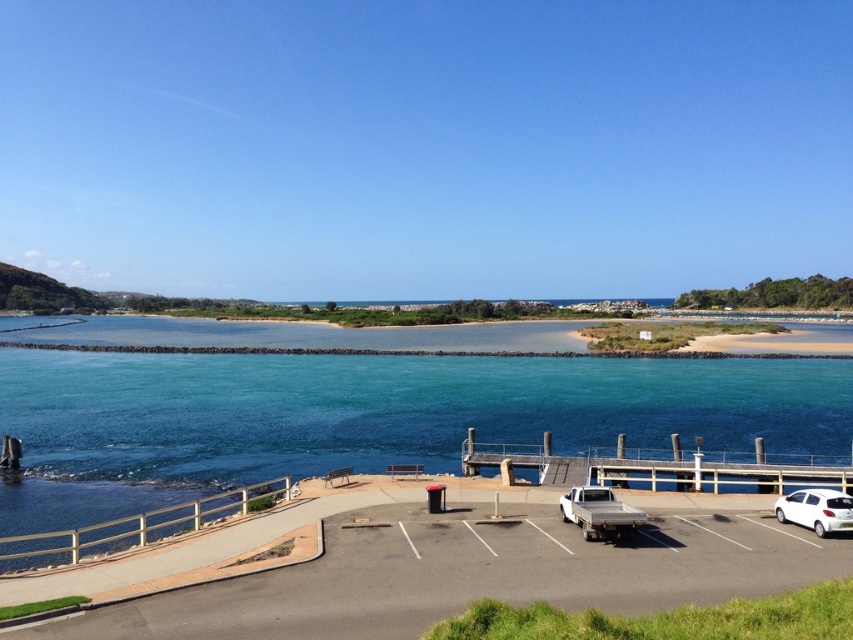
Question: Is black asphalt parking lot at lower center to the left of white matte truck at lower right from the viewer's perspective?

Choices:
 (A) no
 (B) yes

Answer: (B)

Question: Which point appears closest to the camera in this image?

Choices:
 (A) (758, 392)
 (B) (625, 483)
 (C) (840, 504)

Answer: (C)

Question: Which point appears closest to the camera in this image?

Choices:
 (A) (36, 518)
 (B) (780, 460)
 (C) (839, 492)
 (D) (607, 525)

Answer: (D)

Question: Which is farther from the white glossy hatchback at lower right?

Choices:
 (A) black asphalt parking lot at lower center
 (B) wooden dock at center

Answer: (B)

Question: Where is black asphalt parking lot at lower center located in relation to white matte truck at lower right in the image?

Choices:
 (A) above
 (B) below

Answer: (B)

Question: Where is black asphalt parking lot at lower center located in relation to wooden dock at center in the image?

Choices:
 (A) below
 (B) above

Answer: (A)